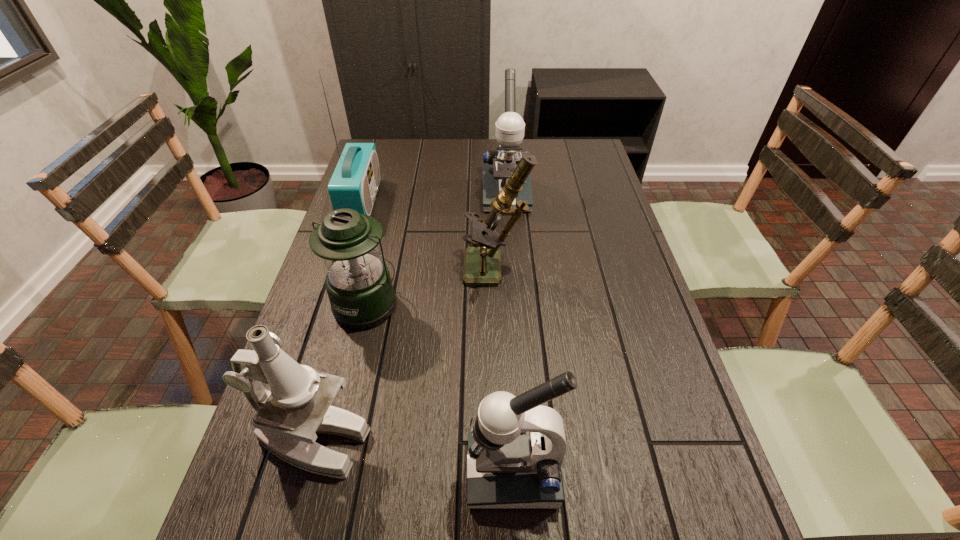
Where is `empty space between the farthest microscope and the leftmost microscope`? empty space between the farthest microscope and the leftmost microscope is located at coordinates (410, 319).

At what (x,y) coordinates should I click in order to perform the action: click on vacant space in between the second farthest microscope and the leftmost microscope. Please return your answer as a coordinate pair (x, y). Looking at the image, I should click on (404, 357).

I want to click on empty space that is in between the shortest object and the farthest microscope, so click(436, 249).

Image resolution: width=960 pixels, height=540 pixels. In order to click on blank region between the farthest microscope and the lantern in this screenshot , I will do `click(436, 249)`.

You are a GUI agent. You are given a task and a screenshot of the screen. Output one action in this format:
    pyautogui.click(x=<x>, y=<y>)
    Task: Click on the free space between the farthest microscope and the lantern
    The height and width of the screenshot is (540, 960).
    Given the screenshot: What is the action you would take?
    pyautogui.click(x=436, y=249)

Image resolution: width=960 pixels, height=540 pixels. What are the coordinates of `free space between the shortest object and the second farthest microscope` in the screenshot? It's located at (431, 288).

Find the location of a particular element. Image resolution: width=960 pixels, height=540 pixels. object that is the closest to the farthest microscope is located at coordinates (482, 266).

Locate which object ranks in proximity to the radio receiver. Please provide its 2D coordinates. Your answer should be formatted as a tuple, i.e. [(x, y)], where the tuple contains the x and y coordinates of a point satisfying the conditions above.

[(358, 283)]

Where is `microscope that can be found as the second closest to the third nearest microscope`? This screenshot has height=540, width=960. microscope that can be found as the second closest to the third nearest microscope is located at coordinates (298, 407).

I want to click on microscope that is the closest one to the second farthest microscope, so click(x=510, y=127).